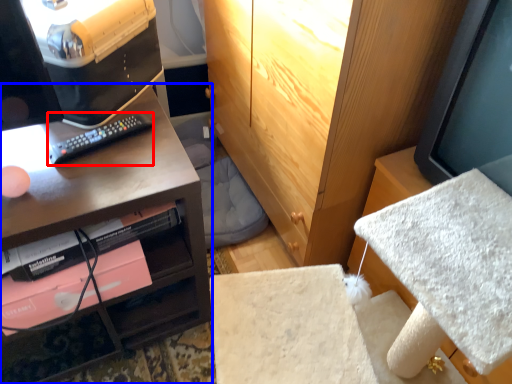
Question: Which object is closer to the camera taking this photo, remote (highlighted by a red box) or desk (highlighted by a blue box)?

Choices:
 (A) remote
 (B) desk

Answer: (B)